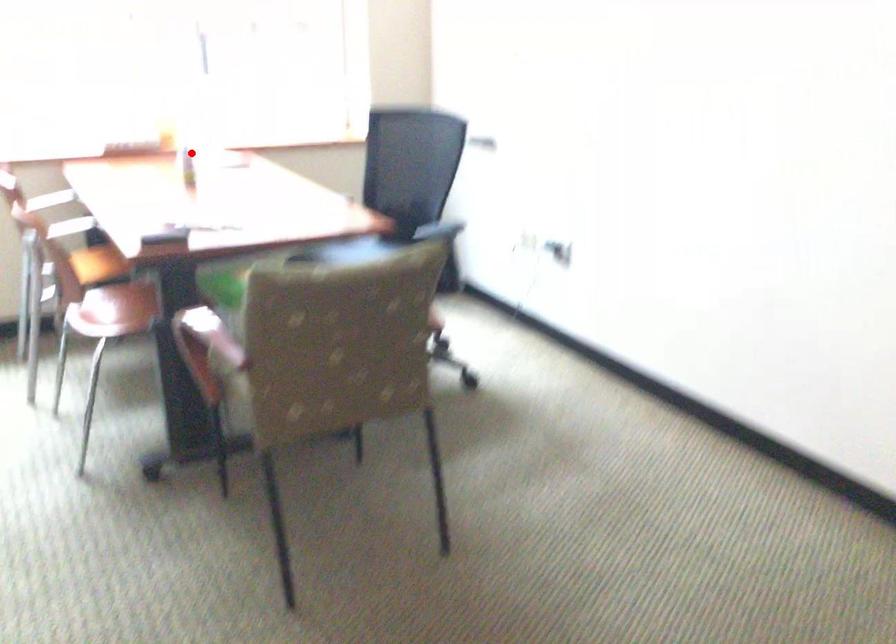
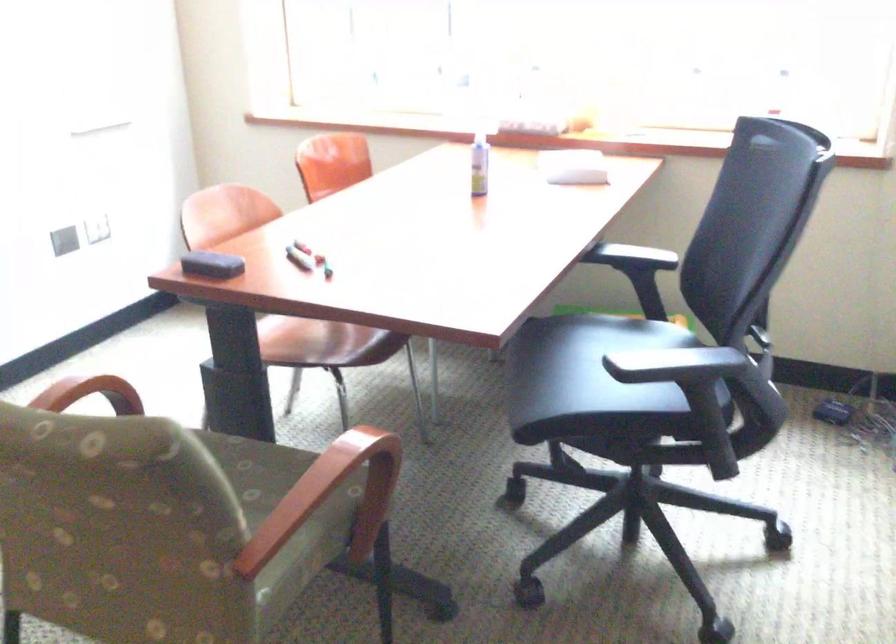
Find the pixel in the second image that matches the highlighted location in the first image.

(478, 164)